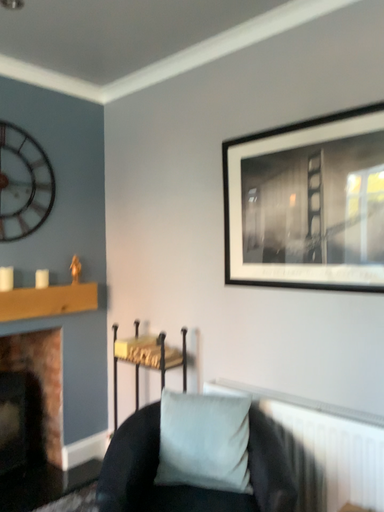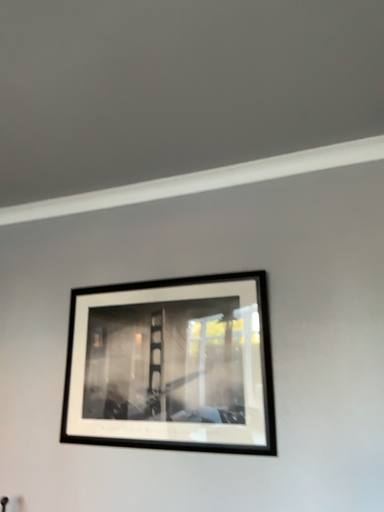
Question: Which way did the camera rotate in the video?

Choices:
 (A) rotated upward
 (B) rotated downward

Answer: (A)